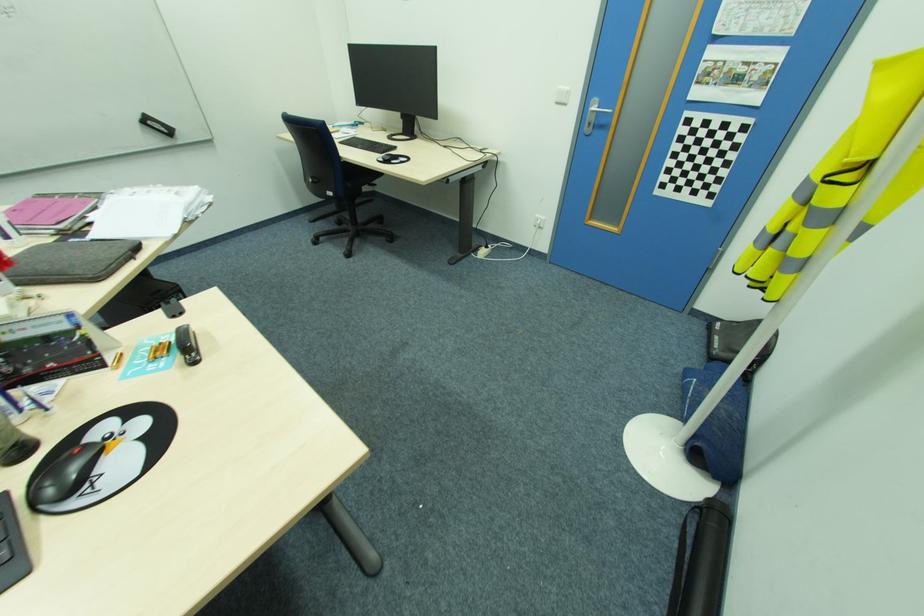
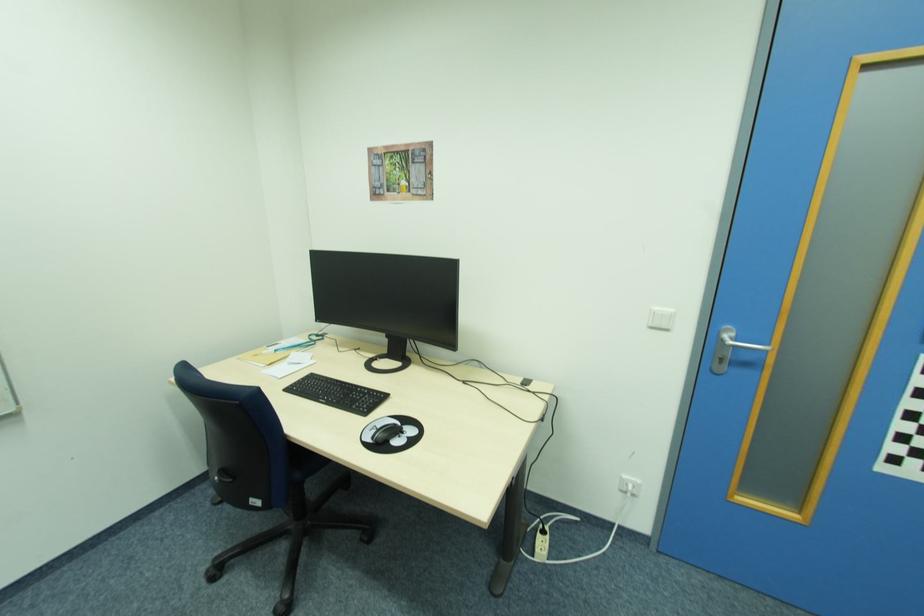
Locate, in the second image, the point that corresponds to (x=614, y=116) in the first image.

(768, 350)